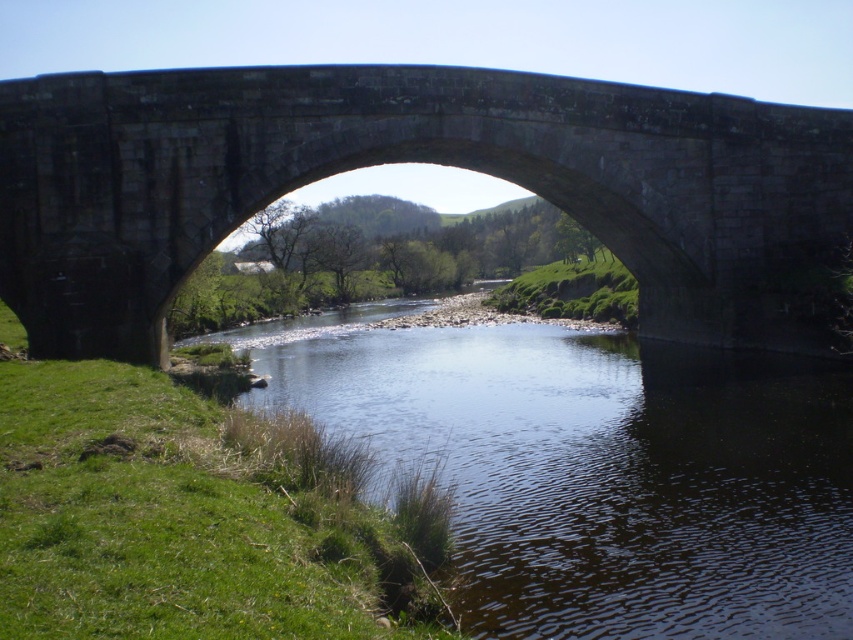
From the picture: You are standing on the riverbank and see the dark gray stone bridge at center and the clear water at center. Which object is positioned to the left side from your perspective?

The dark gray stone bridge at center is to the left of clear water at center, so the dark gray stone bridge at center is positioned to the left side from your perspective.

You are standing on the riverbank and want to cross the river to reach the other side. The dark gray stone bridge at center is the only structure available. Based on its position, can you determine if the bridge is directly over the river?

Yes, the dark gray stone bridge at center is directly over the river since it is positioned at point (413,161), which aligns with the river location in the scene.

You are standing at the viewpoint of the image and see two points marked on the bridge. Which point is closer to you, point (267, 120) or point (492, 364)?

Point (267, 120) is closer to the camera than point (492, 364).